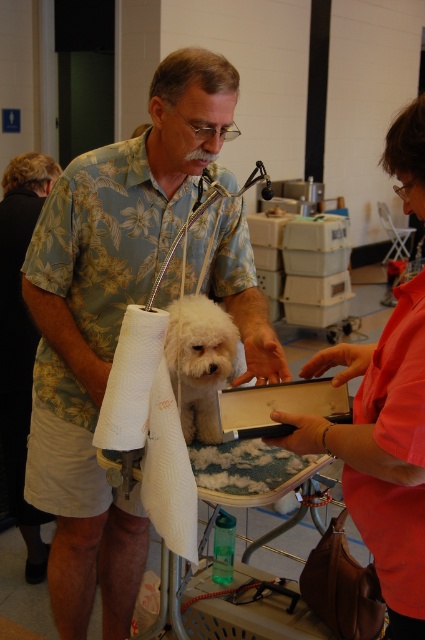
In the scene shown: You are a pet groomer standing at the grooming table. You need to reach for the clippers on the table while wearing the floral shirt at center. Can you comfortably reach them without moving your position?

The floral shirt at center and viewer are 1.34 meters apart, so yes, you can comfortably reach the clippers on the table without moving your position since the distance is within a typical comfortable reach range.

You are a photographer taking a picture of the white paper towel at center and the white fluffy dog at center. Which object will appear larger in the photo?

The white paper towel at center will appear larger in the photo because it is closer to the viewer than the white fluffy dog at center.

You are standing in a pet grooming salon and need to reach the point at coordinates (x=235, y=205). If you are 1.66 meters away from that point, can you reach it without moving closer?

The point at coordinates (x=235, y=205) is exactly 1.66 meters away from you, so if your reach can extend that far, you can reach it without moving closer. Otherwise, you might need to step forward.